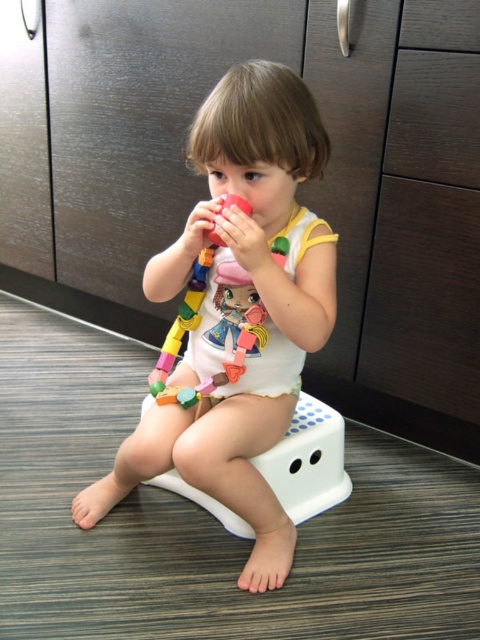
Which is below, white matte onesie at center or wooden blocks at center?

white matte onesie at center is below.

Is white matte onesie at center below wooden blocks at center?

Indeed, white matte onesie at center is positioned under wooden blocks at center.

This screenshot has height=640, width=480. I want to click on white matte onesie at center, so click(239, 310).